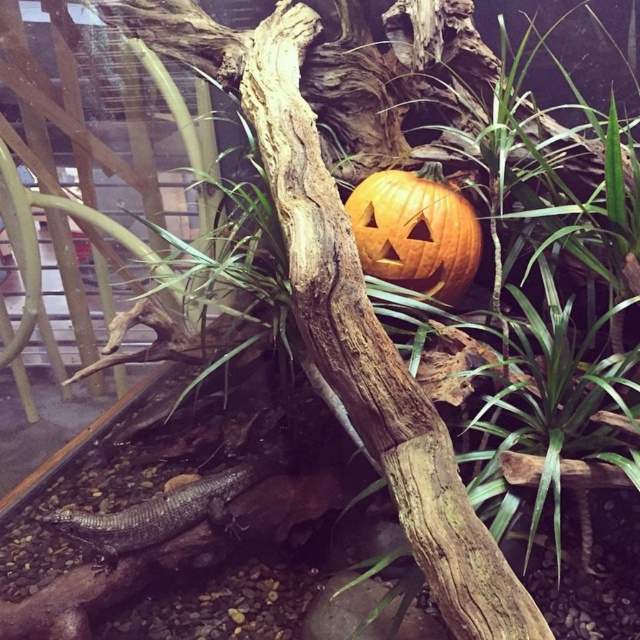
What are the coordinates of the orange matte pumpkin at center?

The orange matte pumpkin at center is located at coordinates point [416,230].

In the scene shown: You are standing in the terrarium scene and want to place a small decoration. You have two points marked as point 1 and point 2. Point 1 is at coordinate point (376, 172) and point 2 is at coordinate point (252, 465). Which point is closer to you?

Point 1 is closer to the viewer than point 2.

You are a small pet lizard that can only jump 1 meter. You are currently on the shiny dark gray lizard at lower left and want to reach the orange matte pumpkin at center. Can you jump directly to it?

The orange matte pumpkin at center and shiny dark gray lizard at lower left are 1.09 meters apart from each other, so the lizard cannot jump directly to the pumpkin as its maximum jump distance is 1 meter.